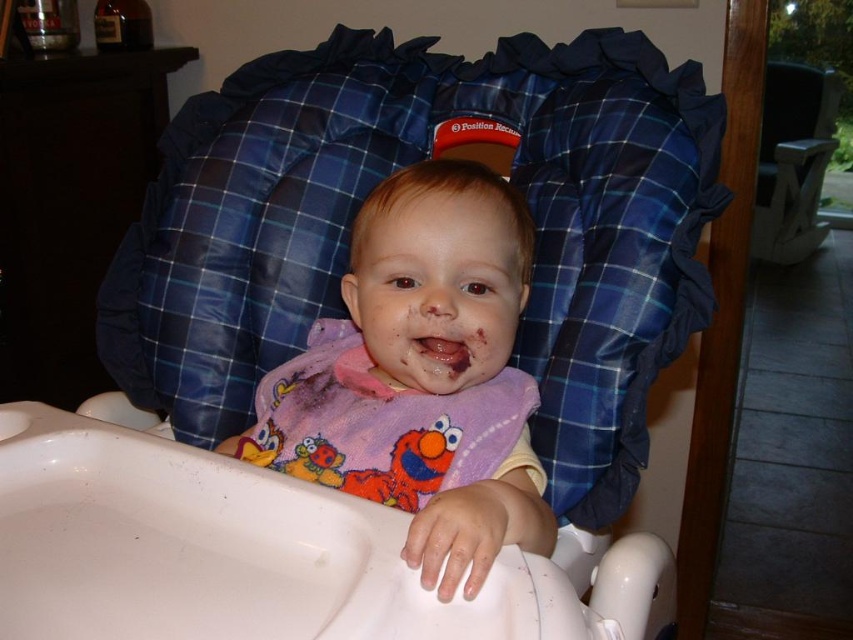
Question: Among these points, which one is farthest from the camera?

Choices:
 (A) (404, 310)
 (B) (773, 68)

Answer: (B)

Question: In this image, where is plaid fabric highchair at upper right located relative to dry skin at mouth center?

Choices:
 (A) above
 (B) below

Answer: (A)

Question: Which object is positioned closest to the dry skin at mouth center?

Choices:
 (A) matte purple bib at center
 (B) purple fleece bib at center

Answer: (A)

Question: Does matte purple bib at center appear under dry skin at mouth center?

Choices:
 (A) no
 (B) yes

Answer: (A)

Question: Which point appears farthest from the camera in this image?

Choices:
 (A) (451, 342)
 (B) (799, 131)
 (C) (432, 177)

Answer: (B)

Question: Does blue plaid cushion at center have a larger size compared to purple fleece bib at center?

Choices:
 (A) yes
 (B) no

Answer: (A)